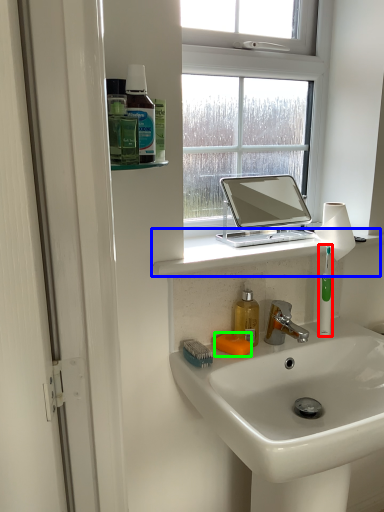
Question: Considering the real-world distances, which object is farthest from toothbrush (highlighted by a red box)? window sill (highlighted by a blue box) or soap (highlighted by a green box)?

Choices:
 (A) window sill
 (B) soap

Answer: (B)